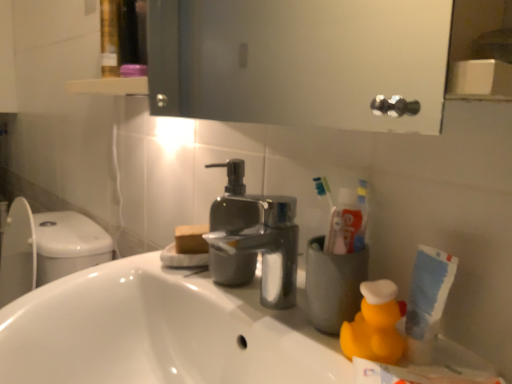
Locate an element on the screen. Image resolution: width=512 pixels, height=384 pixels. vacant region to the left of yellow rubber duck at lower right is located at coordinates (284, 331).